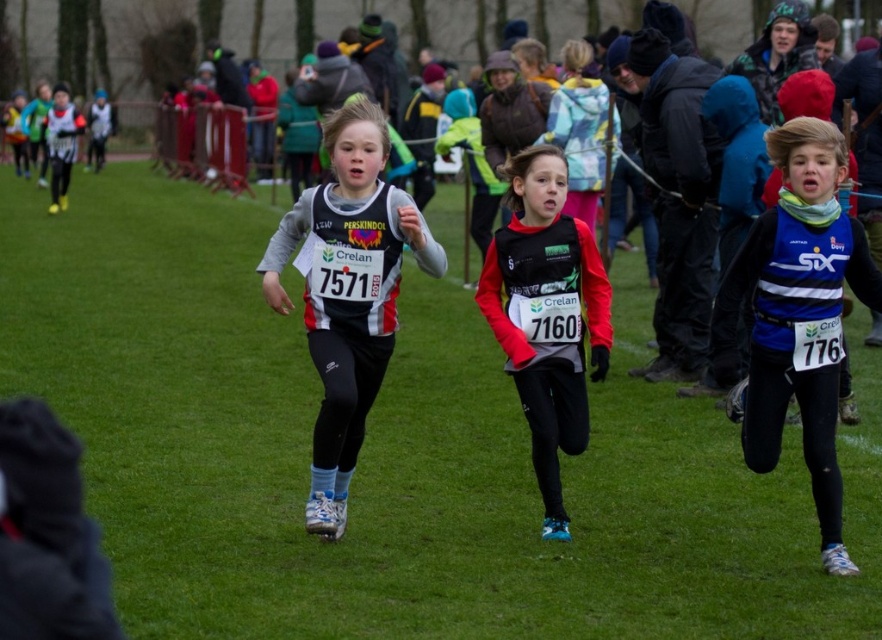
Who is positioned more to the left, blue jersey at center or black matte vest at center?

black matte vest at center is more to the left.

Measure the distance from blue jersey at center to black matte vest at center.

blue jersey at center is 6.39 feet from black matte vest at center.

I want to click on blue jersey at center, so click(x=797, y=316).

Locate an element on the screen. The image size is (882, 640). blue jersey at center is located at coordinates (797, 316).

Is point (529, 225) farther from viewer compared to point (709, 234)?

No, it is not.

Is matte black vest at center to the right of black matte jacket at center from the viewer's perspective?

In fact, matte black vest at center is to the left of black matte jacket at center.

Which is in front, point (522, 216) or point (699, 300)?

Point (522, 216) is in front.

Find the location of `matte black vest at center`. matte black vest at center is located at coordinates (547, 316).

Is black matte vest at center behind matte black vest at center?

No, black matte vest at center is closer to the viewer.

Which is below, black matte vest at center or matte black vest at center?

matte black vest at center is lower down.

Is point (327, 401) behind point (559, 262)?

No.

Where is `black matte vest at center`? Image resolution: width=882 pixels, height=640 pixels. black matte vest at center is located at coordinates (348, 291).